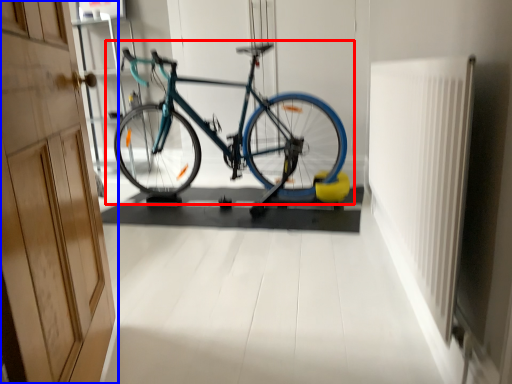
Question: Which of the following is the closest to the observer, bicycle (highlighted by a red box) or door (highlighted by a blue box)?

Choices:
 (A) bicycle
 (B) door

Answer: (B)